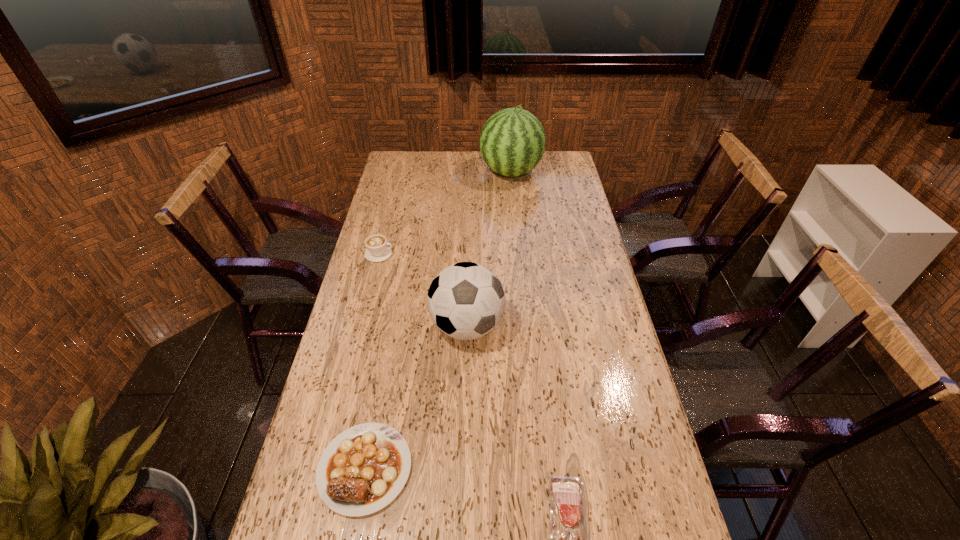
In order to click on free space between the second tallest object and the third tallest object in this screenshot , I will do `click(423, 290)`.

This screenshot has height=540, width=960. I want to click on blank region between the fourth nearest object and the watermelon, so click(x=445, y=213).

You are a GUI agent. You are given a task and a screenshot of the screen. Output one action in this format:
    pyautogui.click(x=<x>, y=<y>)
    Task: Click on the vacant point located between the second shortest object and the third tallest object
    
    Given the screenshot: What is the action you would take?
    pyautogui.click(x=372, y=361)

The height and width of the screenshot is (540, 960). Find the location of `vacant space in between the fourth nearest object and the soccer ball`. vacant space in between the fourth nearest object and the soccer ball is located at coordinates (423, 290).

Locate which object ranks fourth in proximity to the third shortest object. Please provide its 2D coordinates. Your answer should be formatted as a tuple, i.e. [(x, y)], where the tuple contains the x and y coordinates of a point satisfying the conditions above.

[(568, 539)]

Where is `the third closest object to the third nearest object`? The width and height of the screenshot is (960, 540). the third closest object to the third nearest object is located at coordinates (568, 539).

You are a GUI agent. You are given a task and a screenshot of the screen. Output one action in this format:
    pyautogui.click(x=<x>, y=<y>)
    Task: Click on the vacant region that satisfies the following two spatial constraints: 1. on the front side of the watermelon; 2. to the right of the fourth nearest object's handle
    The height and width of the screenshot is (540, 960).
    Given the screenshot: What is the action you would take?
    pyautogui.click(x=518, y=254)

At what (x,y) coordinates should I click in order to perform the action: click on vacant region that satisfies the following two spatial constraints: 1. on the back side of the watermelon; 2. on the right side of the left steak. Please return your answer as a coordinate pair (x, y). Looking at the image, I should click on (420, 172).